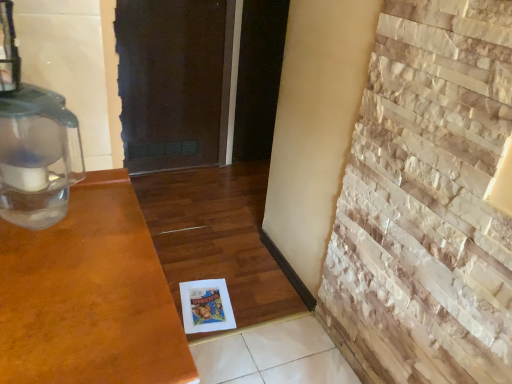
Question: Is transparent plastic oil lamp at left thinner than natural stone fireplace at right?

Choices:
 (A) no
 (B) yes

Answer: (A)

Question: Does transparent plastic oil lamp at left turn towards natural stone fireplace at right?

Choices:
 (A) yes
 (B) no

Answer: (B)

Question: Is transparent plastic oil lamp at left positioned with its back to natural stone fireplace at right?

Choices:
 (A) no
 (B) yes

Answer: (A)

Question: Considering the relative sizes of transparent plastic oil lamp at left and natural stone fireplace at right in the image provided, is transparent plastic oil lamp at left smaller than natural stone fireplace at right?

Choices:
 (A) no
 (B) yes

Answer: (B)

Question: Is transparent plastic oil lamp at left at the right side of natural stone fireplace at right?

Choices:
 (A) yes
 (B) no

Answer: (B)

Question: Is transparent plastic oil lamp at left far from natural stone fireplace at right?

Choices:
 (A) no
 (B) yes

Answer: (A)

Question: Is natural stone fireplace at right closer to camera compared to transparent plastic oil lamp at left?

Choices:
 (A) yes
 (B) no

Answer: (A)

Question: Is natural stone fireplace at right oriented away from transparent plastic oil lamp at left?

Choices:
 (A) yes
 (B) no

Answer: (B)

Question: Does natural stone fireplace at right lie behind transparent plastic oil lamp at left?

Choices:
 (A) yes
 (B) no

Answer: (B)

Question: Is natural stone fireplace at right to the left of transparent plastic oil lamp at left from the viewer's perspective?

Choices:
 (A) no
 (B) yes

Answer: (A)

Question: Is natural stone fireplace at right wider than transparent plastic oil lamp at left?

Choices:
 (A) no
 (B) yes

Answer: (A)

Question: Can you confirm if natural stone fireplace at right is thinner than transparent plastic oil lamp at left?

Choices:
 (A) yes
 (B) no

Answer: (A)

Question: From a real-world perspective, is natural stone fireplace at right physically located above or below transparent plastic oil lamp at left?

Choices:
 (A) below
 (B) above

Answer: (A)